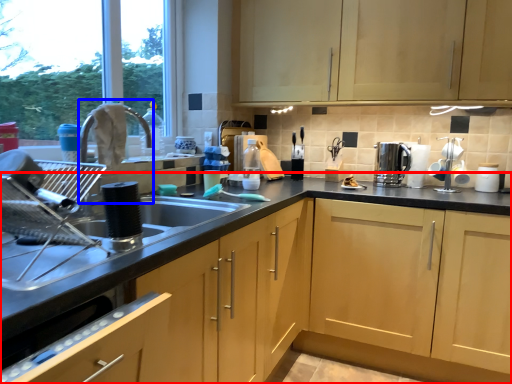
Question: Among these objects, which one is farthest to the camera, cabinetry (highlighted by a red box) or faucet (highlighted by a blue box)?

Choices:
 (A) cabinetry
 (B) faucet

Answer: (B)